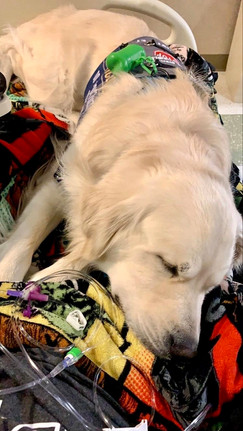
The image size is (243, 431). Identify the location of handle. (161, 14).